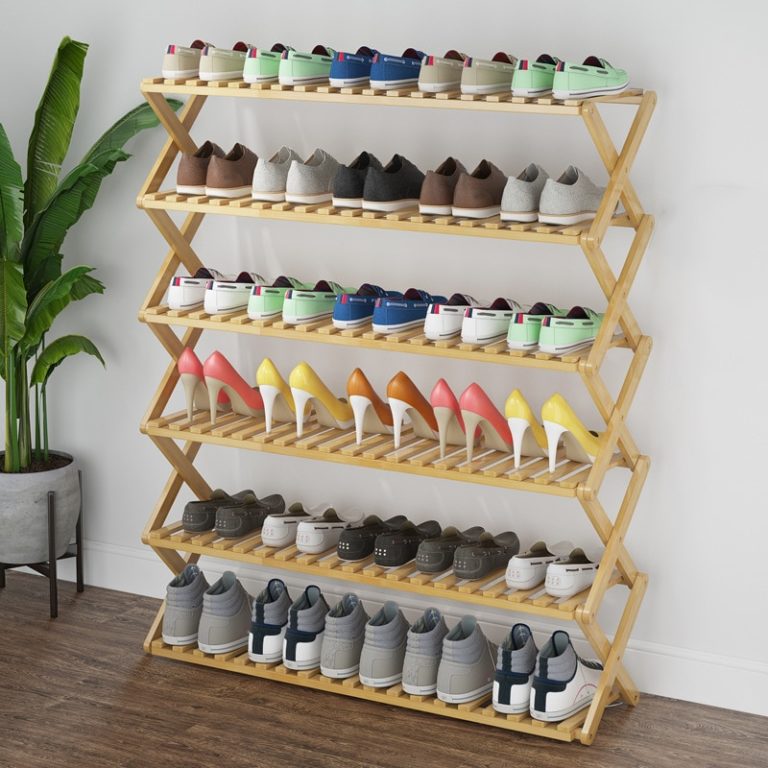
Where is `plant leaves`? plant leaves is located at coordinates (57, 111), (117, 131), (107, 164), (81, 192), (12, 214), (64, 288), (68, 339).